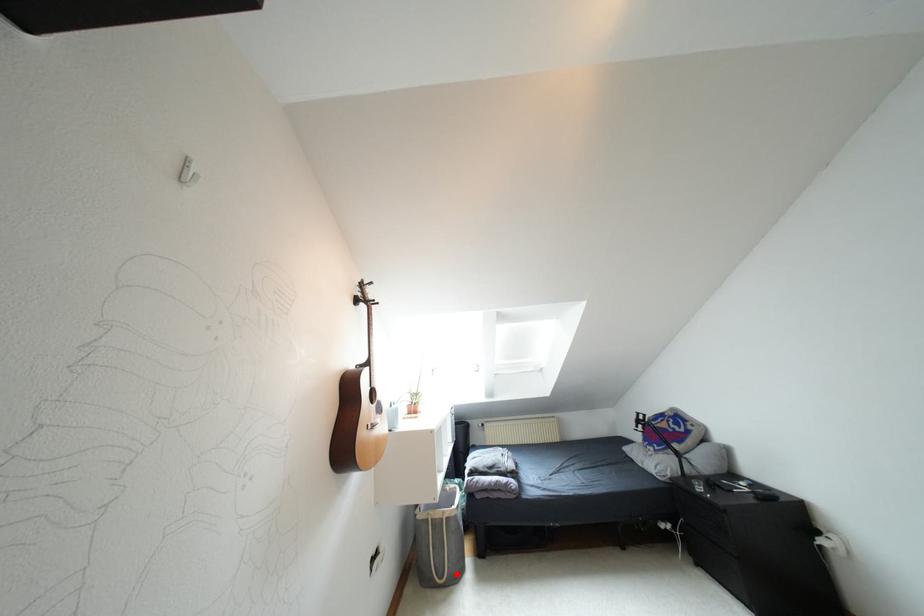
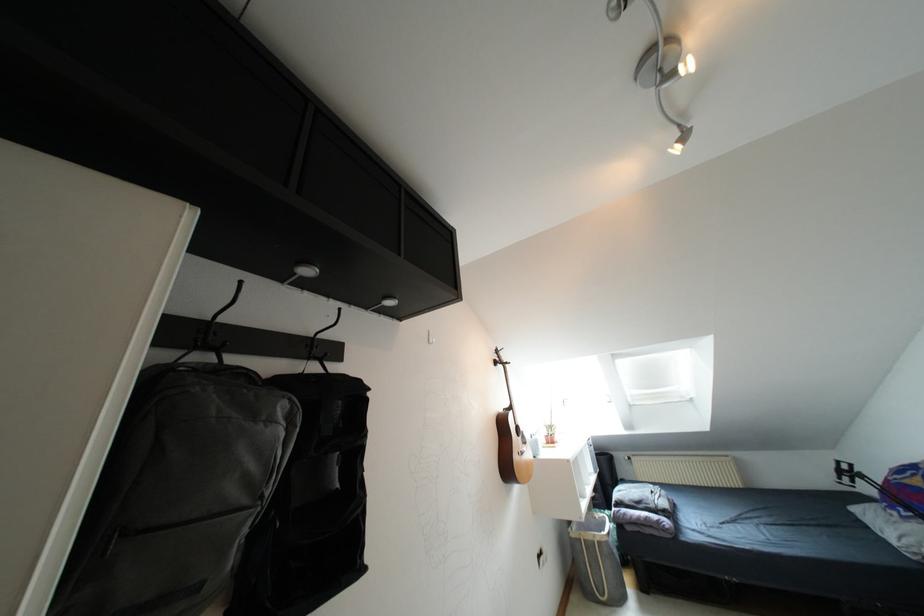
Where in the second image is the point corresponding to the highlighted location from the first image?

(618, 599)